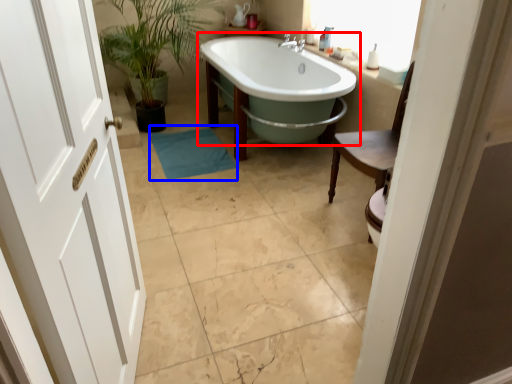
Question: Which of the following is the farthest to the observer, bathtub (highlighted by a red box) or bath mat (highlighted by a blue box)?

Choices:
 (A) bathtub
 (B) bath mat

Answer: (B)